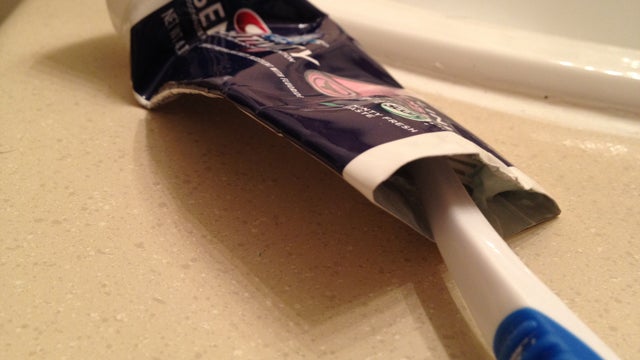
Where is `toothbush`? This screenshot has height=360, width=640. toothbush is located at coordinates (486, 272).